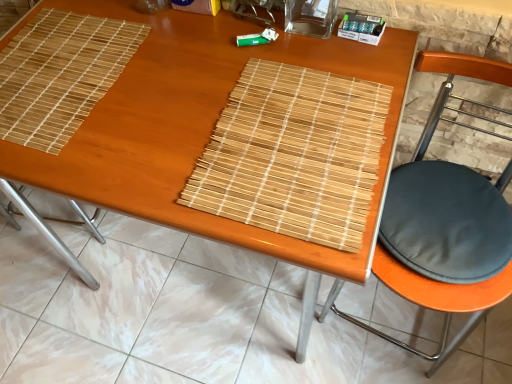
Question: Is black fabric cushion at right oriented away from bamboo placemat at center?

Choices:
 (A) yes
 (B) no

Answer: (B)

Question: Is bamboo placemat at center located within black fabric cushion at right?

Choices:
 (A) no
 (B) yes

Answer: (A)

Question: From the image's perspective, is black fabric cushion at right below bamboo placemat at center?

Choices:
 (A) no
 (B) yes

Answer: (A)

Question: Is black fabric cushion at right thinner than bamboo placemat at center?

Choices:
 (A) yes
 (B) no

Answer: (A)

Question: Considering the relative positions of black fabric cushion at right and bamboo placemat at center in the image provided, is black fabric cushion at right in front of bamboo placemat at center?

Choices:
 (A) no
 (B) yes

Answer: (B)

Question: From the image's perspective, is natural wood mat at upper left, positioned as the second mat in right-to-left order, located above or below bamboo placemat at center?

Choices:
 (A) above
 (B) below

Answer: (A)

Question: Considering their positions, is natural wood mat at upper left, positioned as the second mat in right-to-left order, located in front of or behind bamboo placemat at center?

Choices:
 (A) behind
 (B) front

Answer: (B)

Question: From their relative heights in the image, would you say natural wood mat at upper left, which is counted as the 1th mat, starting from the left, is taller or shorter than bamboo placemat at center?

Choices:
 (A) short
 (B) tall

Answer: (A)

Question: In the image, is natural wood mat at upper left, positioned as the second mat in right-to-left order, on the left side or the right side of bamboo placemat at center?

Choices:
 (A) right
 (B) left

Answer: (B)

Question: In the image, is black fabric cushion at right positioned in front of or behind bamboo placemat at center?

Choices:
 (A) behind
 (B) front

Answer: (B)

Question: Is point (478, 309) positioned closer to the camera than point (425, 339)?

Choices:
 (A) farther
 (B) closer

Answer: (B)

Question: Is black fabric cushion at right to the left or to the right of bamboo placemat at center in the image?

Choices:
 (A) left
 (B) right

Answer: (B)

Question: Which is correct: black fabric cushion at right is inside bamboo placemat at center, or outside of it?

Choices:
 (A) inside
 (B) outside

Answer: (B)

Question: Considering the positions of natural wood mat at upper left, which is counted as the 1th mat, starting from the left, and black fabric cushion at right in the image, is natural wood mat at upper left, which is counted as the 1th mat, starting from the left, taller or shorter than black fabric cushion at right?

Choices:
 (A) short
 (B) tall

Answer: (A)

Question: From the image's perspective, relative to black fabric cushion at right, is natural wood mat at upper left, positioned as the second mat in right-to-left order, above or below?

Choices:
 (A) above
 (B) below

Answer: (A)